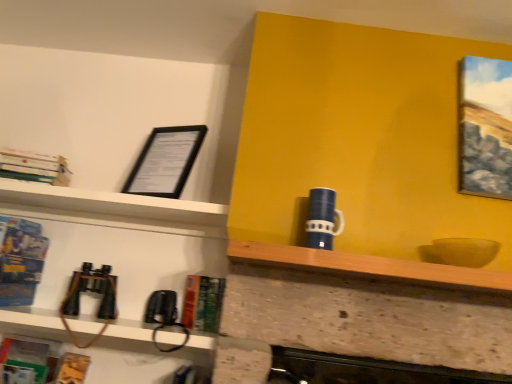
This screenshot has width=512, height=384. Identify the location of wooden at center. (371, 267).

Find the location of `blue glossy mug at upper center`. blue glossy mug at upper center is located at coordinates [322, 219].

Locate an element on the screen. The width and height of the screenshot is (512, 384). hardcover books at upper left, positioned as the second book in right-to-left order is located at coordinates (35, 167).

Measure the distance between point (20, 157) and camera.

Point (20, 157) and camera are 4.91 feet apart.

Locate an element on the screen. wooden at center is located at coordinates (371, 267).

Looking at their sizes, would you say hardcover book at lower left, marked as the 1th book in a bottom-to-top arrangement, is wider or thinner than wooden at center?

In the image, hardcover book at lower left, marked as the 1th book in a bottom-to-top arrangement, appears to be more narrow than wooden at center.

Is hardcover book at lower left, which ranks as the 2th book in left-to-right order, completely or partially outside of wooden at center?

Yes, hardcover book at lower left, which ranks as the 2th book in left-to-right order, is outside of wooden at center.

Where is `the 3rd book positioned below the wooden at center (from the image's perspective)`? The height and width of the screenshot is (384, 512). the 3rd book positioned below the wooden at center (from the image's perspective) is located at coordinates (39, 364).

Which of these two, hardcover book at lower left, which appears as the third book when viewed from the right, or wooden at center, stands shorter?

Standing shorter between the two is wooden at center.

Is blue glossy mug at upper center beside black matte picture frame at upper left?

blue glossy mug at upper center and black matte picture frame at upper left are clearly separated.

Is point (323, 225) positioned before point (149, 162)?

Yes.

Considering the sizes of objects blue glossy mug at upper center and black matte picture frame at upper left in the image provided, who is shorter, blue glossy mug at upper center or black matte picture frame at upper left?

blue glossy mug at upper center.

From the image's perspective, is hardcover book at lower left, marked as the 1th book in a bottom-to-top arrangement, above or below hardcover books at upper left, positioned as the second book in right-to-left order?

hardcover book at lower left, marked as the 1th book in a bottom-to-top arrangement, is below hardcover books at upper left, positioned as the second book in right-to-left order.

From a real-world perspective, does hardcover book at lower left, which ranks as the 2th book in left-to-right order, stand above hardcover books at upper left, positioned as the second book in right-to-left order?

Incorrect, from a real-world perspective, hardcover book at lower left, which ranks as the 2th book in left-to-right order, is lower than hardcover books at upper left, positioned as the second book in right-to-left order.

From the image's perspective, starting from the hardcover books at upper left, marked as the fourth book in a bottom-to-top arrangement, which book is the 3rd one below? Please provide its 2D coordinates.

[(39, 364)]

Is hardcover book at lower left, which appears as the third book when viewed from the right, beside hardcover books at upper left, positioned as the second book in right-to-left order?

They are not placed beside each other.

Which point is more forward, (9, 271) or (288, 262)?

The point (288, 262) is in front.

From the image's perspective, is blue glossy book at left, which ranks as the first book in left-to-right order, above or below wooden at center?

Based on their image positions, blue glossy book at left, which ranks as the first book in left-to-right order, is located beneath wooden at center.

Is blue glossy book at left, which is the second book in top-to-bottom order, situated inside wooden at center or outside?

blue glossy book at left, which is the second book in top-to-bottom order, is not inside wooden at center, it's outside.

Is blue glossy book at left, which ranks as the first book in left-to-right order, in contact with black matte picture frame at upper left?

No, blue glossy book at left, which ranks as the first book in left-to-right order, is not next to black matte picture frame at upper left.

From the picture: Can you confirm if blue glossy book at left, the fourth book in the right-to-left sequence, is thinner than black matte picture frame at upper left?

In fact, blue glossy book at left, the fourth book in the right-to-left sequence, might be wider than black matte picture frame at upper left.

The height and width of the screenshot is (384, 512). What are the coordinates of `book in front of the black matte picture frame at upper left` in the screenshot? It's located at (20, 260).

Considering the sizes of blue glossy book at left, the fourth book in the right-to-left sequence, and black matte picture frame at upper left in the image, is blue glossy book at left, the fourth book in the right-to-left sequence, bigger or smaller than black matte picture frame at upper left?

In the image, blue glossy book at left, the fourth book in the right-to-left sequence, appears to be larger than black matte picture frame at upper left.

From a real-world perspective, is black matte picture frame at upper left located higher than wooden at center?

Yes, from a real-world perspective, black matte picture frame at upper left is over wooden at center

Image resolution: width=512 pixels, height=384 pixels. I want to click on shelf lying in front of the black matte picture frame at upper left, so click(x=371, y=267).

Is black matte picture frame at upper left looking in the opposite direction of wooden at center?

No.

From the image's perspective, between black matte picture frame at upper left and wooden at center, who is located below?

wooden at center, from the image's perspective.

Would you say blue glossy book at left, the fourth book in the right-to-left sequence, is outside hardcover book at center, the 2th book when ordered from bottom to top?

Yes, blue glossy book at left, the fourth book in the right-to-left sequence, is located beyond the bounds of hardcover book at center, the 2th book when ordered from bottom to top.

Considering the relative sizes of blue glossy book at left, which appears as the 3th book when ordered from the bottom, and hardcover book at center, acting as the 4th book starting from the left, in the image provided, is blue glossy book at left, which appears as the 3th book when ordered from the bottom, thinner than hardcover book at center, acting as the 4th book starting from the left,?

In fact, blue glossy book at left, which appears as the 3th book when ordered from the bottom, might be wider than hardcover book at center, acting as the 4th book starting from the left.

From the image's perspective, which one is positioned lower, blue glossy book at left, the fourth book in the right-to-left sequence, or hardcover book at center, arranged as the 3th book when viewed from the top?

hardcover book at center, arranged as the 3th book when viewed from the top, from the image's perspective.

Considering the positions of point (27, 299) and point (189, 323), is point (27, 299) closer or farther from the camera than point (189, 323)?

Point (27, 299) appears to be farther away from the viewer than point (189, 323).

At what (x,y) coordinates should I click in order to perform the action: click on the 3rd book counting from the left side of the wooden at center. Please return your answer as a coordinate pair (x, y). The image size is (512, 384). Looking at the image, I should click on (39, 364).

This screenshot has width=512, height=384. What are the coordinates of `mug below the black matte picture frame at upper left (from a real-world perspective)` in the screenshot? It's located at (322, 219).

When comparing their distances from wooden at center, does black matte picture frame at upper left or hardcover books at upper left, which is the 3th book in left-to-right order, seem further?

Among the two, hardcover books at upper left, which is the 3th book in left-to-right order, is located further to wooden at center.

Estimate the real-world distances between objects in this image. Which object is further from wooden at center, blue glossy mug at upper center or hardcover book at lower left, acting as the 4th book starting from the top?

hardcover book at lower left, acting as the 4th book starting from the top.

Estimate the real-world distances between objects in this image. Which object is closer to wooden at center, hardcover book at center, arranged as the 3th book when viewed from the top, or hardcover book at lower left, which appears as the third book when viewed from the right?

hardcover book at center, arranged as the 3th book when viewed from the top, lies closer to wooden at center than the other object.

Estimate the real-world distances between objects in this image. Which object is further from black matte picture frame at upper left, hardcover books at upper left, which is the 3th book in left-to-right order, or wooden at center?

The object further to black matte picture frame at upper left is wooden at center.

Considering their positions, is black matte picture frame at upper left positioned closer to hardcover book at lower left, which ranks as the 2th book in left-to-right order, than hardcover books at upper left, which ranks as the first book in top-to-bottom order?

hardcover books at upper left, which ranks as the first book in top-to-bottom order.

When comparing their distances from hardcover books at upper left, positioned as the second book in right-to-left order, does blue glossy mug at upper center or hardcover book at center, arranged as the 3th book when viewed from the top, seem further?

blue glossy mug at upper center is positioned further to the anchor hardcover books at upper left, positioned as the second book in right-to-left order.

Estimate the real-world distances between objects in this image. Which object is closer to wooden at center, hardcover books at upper left, marked as the fourth book in a bottom-to-top arrangement, or black matte picture frame at upper left?

The object closer to wooden at center is black matte picture frame at upper left.

Estimate the real-world distances between objects in this image. Which object is closer to wooden at center, blue glossy mug at upper center or hardcover books at upper left, marked as the fourth book in a bottom-to-top arrangement?

The object closer to wooden at center is blue glossy mug at upper center.

What are the coordinates of `picture frame situated between hardcover book at lower left, acting as the 4th book starting from the top, and blue glossy mug at upper center from left to right` in the screenshot? It's located at (165, 161).

Find the location of a particular element. This screenshot has width=512, height=384. picture frame situated between blue glossy book at left, the fourth book in the right-to-left sequence, and wooden at center from left to right is located at coordinates (165, 161).

Where is `book between black matte picture frame at upper left and wooden at center from left to right`? The image size is (512, 384). book between black matte picture frame at upper left and wooden at center from left to right is located at coordinates (202, 303).

Where is `picture frame between blue glossy book at left, which appears as the 3th book when ordered from the bottom, and blue glossy mug at upper center from left to right`? Image resolution: width=512 pixels, height=384 pixels. picture frame between blue glossy book at left, which appears as the 3th book when ordered from the bottom, and blue glossy mug at upper center from left to right is located at coordinates (165, 161).